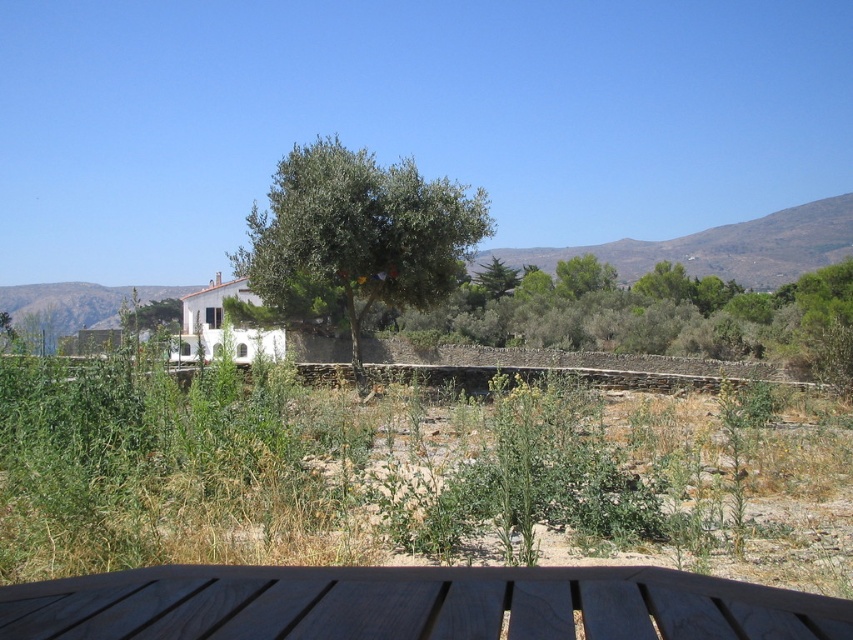
You are standing at the origin point of the image coordinate system. Where is the wooden picnic table at lower center located?

The wooden picnic table at lower center is located at point (412, 604).

You are planning to set up a small garden in your backyard and want to ensure there is enough space between the wooden picnic table at lower center and the green leafy olive tree at center. Based on their heights, which one should be placed closer to the ground level?

The wooden picnic table at lower center has a lesser height compared to the green leafy olive tree at center, so the wooden picnic table at lower center should be placed closer to the ground level since it is shorter.